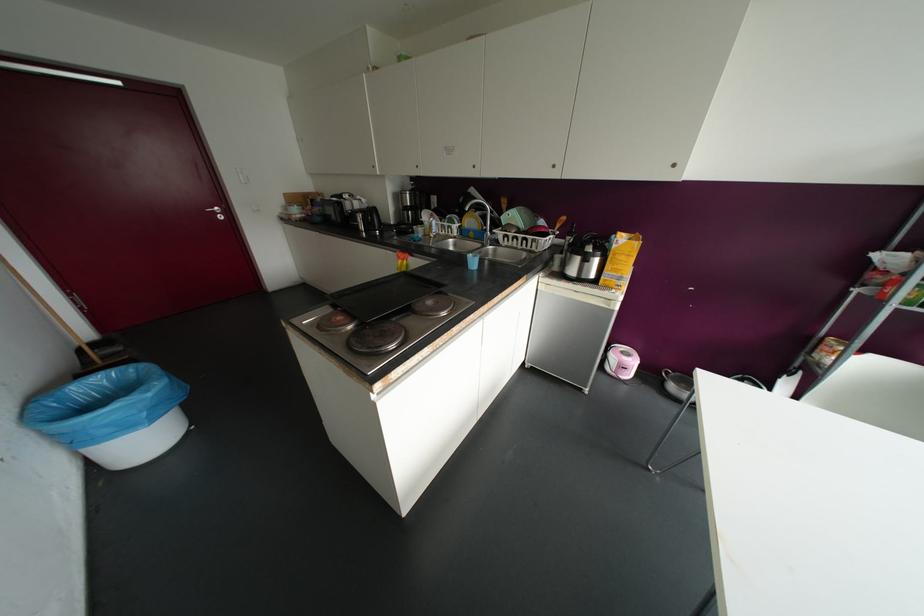
The width and height of the screenshot is (924, 616). In order to click on faucet handle in this screenshot , I will do `click(489, 237)`.